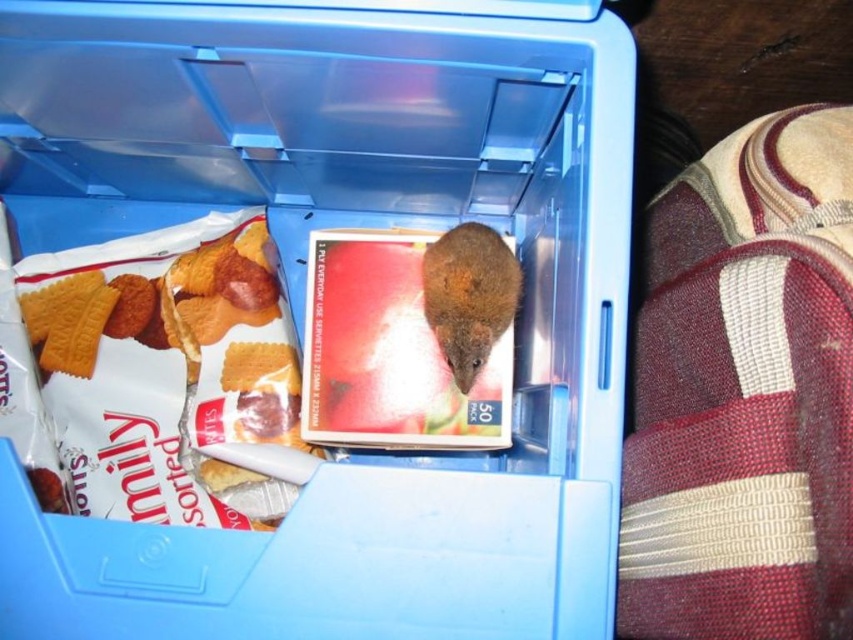
Question: Can you confirm if matte white biscuit packet at left is positioned below brown furry mouse at center?

Choices:
 (A) yes
 (B) no

Answer: (A)

Question: Does matte white biscuit packet at left have a greater width compared to brown furry mouse at center?

Choices:
 (A) no
 (B) yes

Answer: (B)

Question: Among these objects, which one is nearest to the camera?

Choices:
 (A) matte white biscuit packet at left
 (B) brown furry mouse at center

Answer: (B)

Question: Which point is farther from the camera taking this photo?

Choices:
 (A) (61, 314)
 (B) (468, 369)

Answer: (A)

Question: Which point is closer to the camera taking this photo?

Choices:
 (A) (154, 352)
 (B) (497, 296)

Answer: (B)

Question: Considering the relative positions of matte white biscuit packet at left and brown furry mouse at center in the image provided, where is matte white biscuit packet at left located with respect to brown furry mouse at center?

Choices:
 (A) left
 (B) right

Answer: (A)